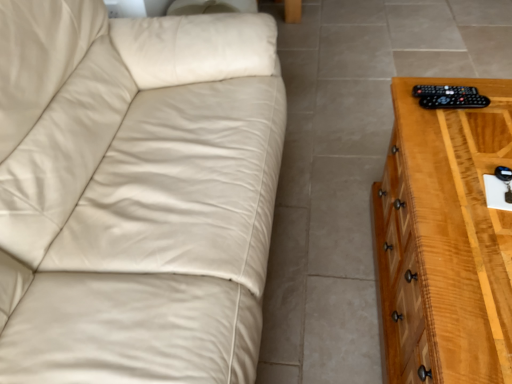
Question: From a real-world perspective, is black plastic remote at right positioned above or below light brown wooden chest of drawers at right?

Choices:
 (A) below
 (B) above

Answer: (B)

Question: Is black plastic remote at right taller or shorter than light brown wooden chest of drawers at right?

Choices:
 (A) tall
 (B) short

Answer: (B)

Question: Which object is positioned farthest from the light brown wooden chest of drawers at right?

Choices:
 (A) black plastic remote at right
 (B) black plastic remote at right

Answer: (B)

Question: Considering the real-world distances, which object is closest to the black plastic remote at right?

Choices:
 (A) light brown wooden chest of drawers at right
 (B) black plastic remote at right

Answer: (B)